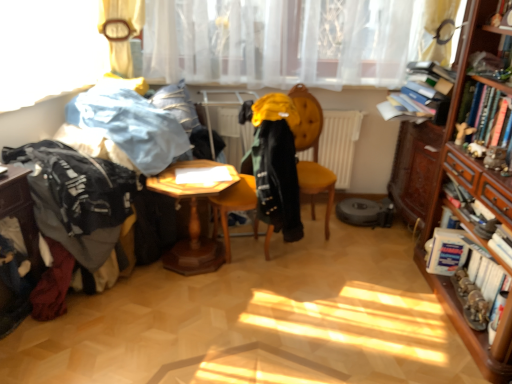
Question: Can you confirm if yellow fabric coat at center, the 3th clothing from the left, is positioned to the left of white matte radiator at center?

Choices:
 (A) yes
 (B) no

Answer: (A)

Question: Is yellow fabric coat at center, the 3th clothing from the left, smaller than white matte radiator at center?

Choices:
 (A) no
 (B) yes

Answer: (A)

Question: Is yellow fabric coat at center, the 1th clothing in the right-to-left sequence, far from white matte radiator at center?

Choices:
 (A) no
 (B) yes

Answer: (A)

Question: Is the position of yellow fabric coat at center, the 1th clothing in the right-to-left sequence, more distant than that of white matte radiator at center?

Choices:
 (A) yes
 (B) no

Answer: (B)

Question: Does yellow fabric coat at center, the 3th clothing from the left, come in front of white matte radiator at center?

Choices:
 (A) yes
 (B) no

Answer: (A)

Question: Is wooden hexagonal table at lower left, which is counted as the second table, starting from the right, wider or thinner than velvet yellow chair at center?

Choices:
 (A) thin
 (B) wide

Answer: (A)

Question: From a real-world perspective, is wooden hexagonal table at lower left, the 1th table when ordered from left to right, positioned above or below velvet yellow chair at center?

Choices:
 (A) above
 (B) below

Answer: (B)

Question: Based on their sizes in the image, would you say wooden hexagonal table at lower left, the 1th table when ordered from left to right, is bigger or smaller than velvet yellow chair at center?

Choices:
 (A) small
 (B) big

Answer: (A)

Question: Is wooden hexagonal table at lower left, which is counted as the second table, starting from the right, situated inside velvet yellow chair at center or outside?

Choices:
 (A) inside
 (B) outside

Answer: (B)

Question: From a real-world perspective, is yellow fabric coat at center, the 3th clothing from the left, above or below wooden drawer at right?

Choices:
 (A) above
 (B) below

Answer: (B)

Question: Would you say yellow fabric coat at center, the 1th clothing in the right-to-left sequence, is to the left or to the right of wooden drawer at right in the picture?

Choices:
 (A) left
 (B) right

Answer: (A)

Question: Is point (279, 145) positioned closer to the camera than point (453, 160)?

Choices:
 (A) closer
 (B) farther

Answer: (A)

Question: Is yellow fabric coat at center, the 3th clothing from the left, taller or shorter than wooden drawer at right?

Choices:
 (A) tall
 (B) short

Answer: (A)

Question: Considering the positions of white matte radiator at center and yellow fabric coat at center, the 3th clothing from the left, in the image, is white matte radiator at center taller or shorter than yellow fabric coat at center, the 3th clothing from the left,?

Choices:
 (A) tall
 (B) short

Answer: (B)

Question: Do you think white matte radiator at center is within yellow fabric coat at center, the 3th clothing from the left, or outside of it?

Choices:
 (A) inside
 (B) outside

Answer: (B)